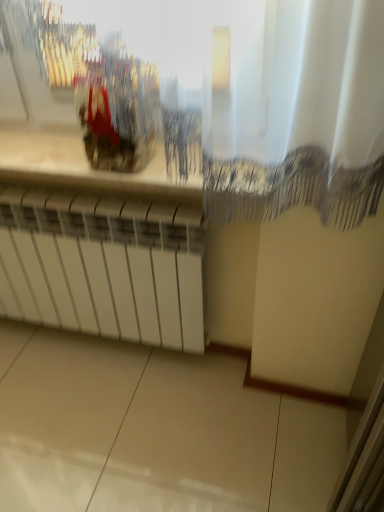
Where is `white matte radiator at lower left`? white matte radiator at lower left is located at coordinates (105, 266).

The height and width of the screenshot is (512, 384). What do you see at coordinates (105, 266) in the screenshot?
I see `white matte radiator at lower left` at bounding box center [105, 266].

Identify the location of white matte radiator at lower left. Image resolution: width=384 pixels, height=512 pixels. (105, 266).